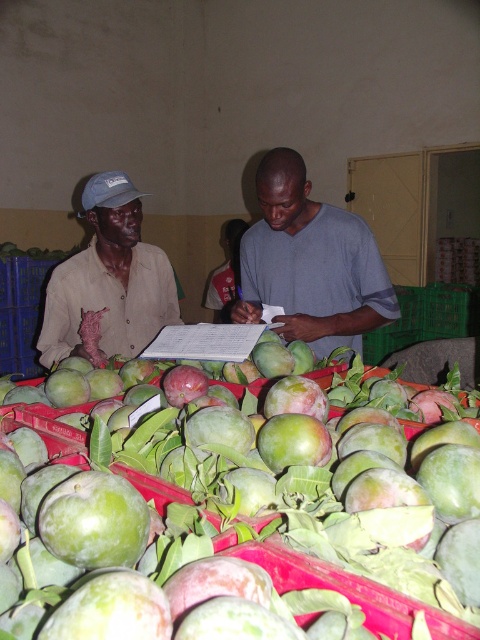
Is green matte mangoes at center closer to the viewer compared to gray matte shirt at center?

Yes, it is in front of gray matte shirt at center.

Who is shorter, green matte mangoes at center or gray matte shirt at center?

With less height is green matte mangoes at center.

This screenshot has width=480, height=640. What do you see at coordinates (245, 524) in the screenshot?
I see `green matte mangoes at center` at bounding box center [245, 524].

In order to click on green matte mangoes at center in this screenshot , I will do [x=245, y=524].

Can you confirm if green matte mangoes at center is thinner than matte khaki shirt at left?

In fact, green matte mangoes at center might be wider than matte khaki shirt at left.

Does point (215, 442) lie in front of point (98, 260)?

Yes.

The width and height of the screenshot is (480, 640). What are the coordinates of `green matte mangoes at center` in the screenshot? It's located at (245, 524).

Can you confirm if gray matte shirt at center is positioned above matte khaki shirt at left?

Yes, gray matte shirt at center is above matte khaki shirt at left.

Is point (285, 218) more distant than point (101, 193)?

That is False.

Find the location of a particular element. gray matte shirt at center is located at coordinates (311, 262).

Find the location of a particular element. Image resolution: width=480 pixels, height=640 pixels. gray matte shirt at center is located at coordinates (311, 262).